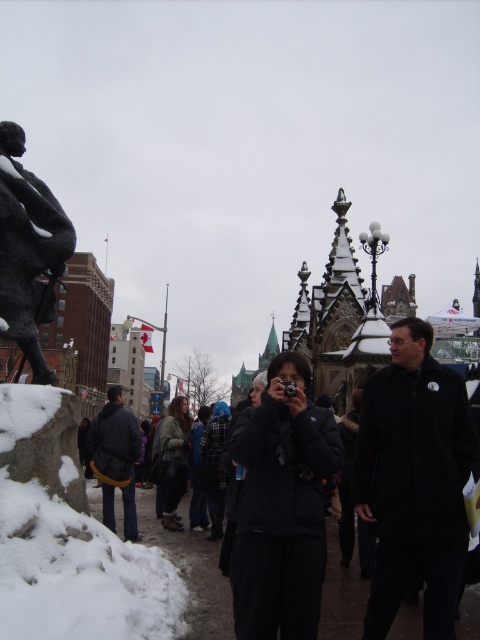
You are standing at the origin point of the image. Where is the black fabric jacket at center located in relation to you?

The black fabric jacket at center is located at point 0.895 in the x direction and 0.400 in the y direction from your current position.

You are a photographer standing in the snowy urban scene and want to capture both the black matte coat at center and the black matte jacket at center in your photo. Which one will appear taller in the frame?

The black matte coat at center will appear taller in the frame because it has a greater height compared to the black matte jacket at center.